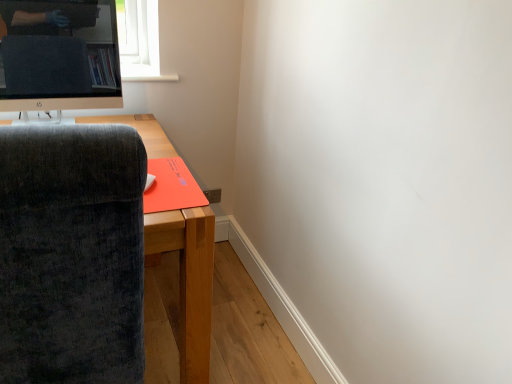
This screenshot has height=384, width=512. What are the coordinates of `orange matte mousepad at lower left` in the screenshot? It's located at (170, 187).

I want to click on dark gray fabric chair at left, so (x=188, y=284).

What do you see at coordinates (59, 55) in the screenshot? I see `satin black monitor at upper left` at bounding box center [59, 55].

The image size is (512, 384). What are the coordinates of `satin black monitor at upper left` in the screenshot? It's located at (59, 55).

Identify the location of orange matte mousepad at lower left. (170, 187).

How different are the orientations of velvet dark gray chair at left and satin black monitor at upper left in degrees?

The facing directions of velvet dark gray chair at left and satin black monitor at upper left are 178 degrees apart.

Which of these two, velvet dark gray chair at left or satin black monitor at upper left, stands taller?

With more height is velvet dark gray chair at left.

Is velvet dark gray chair at left closer to the viewer compared to satin black monitor at upper left?

Yes, it is.

Are velvet dark gray chair at left and satin black monitor at upper left far apart?

Indeed, velvet dark gray chair at left is not near satin black monitor at upper left.

Considering the sizes of satin black monitor at upper left and velvet dark gray chair at left in the image, is satin black monitor at upper left taller or shorter than velvet dark gray chair at left?

satin black monitor at upper left is shorter than velvet dark gray chair at left.

Is satin black monitor at upper left not close to velvet dark gray chair at left?

satin black monitor at upper left is far away from velvet dark gray chair at left.

Based on the photo, looking at the image, does satin black monitor at upper left seem bigger or smaller compared to velvet dark gray chair at left?

In the image, satin black monitor at upper left appears to be smaller than velvet dark gray chair at left.

From a real-world perspective, between satin black monitor at upper left and velvet dark gray chair at left, who is vertically lower?

In real-world perspective, velvet dark gray chair at left is lower.

Would you say satin black monitor at upper left is a long distance from dark gray fabric chair at left?

No.

Where is `entertainment center lying in front of the satin black monitor at upper left`? This screenshot has height=384, width=512. entertainment center lying in front of the satin black monitor at upper left is located at coordinates (188, 284).

Can you confirm if satin black monitor at upper left is taller than orange matte mousepad at lower left?

Indeed, satin black monitor at upper left has a greater height compared to orange matte mousepad at lower left.

Looking at their sizes, would you say satin black monitor at upper left is wider or thinner than orange matte mousepad at lower left?

satin black monitor at upper left is thinner than orange matte mousepad at lower left.

Which object is further away from the camera taking this photo, satin black monitor at upper left or orange matte mousepad at lower left?

satin black monitor at upper left is more distant.

Where is `television located behind the orange matte mousepad at lower left`? The height and width of the screenshot is (384, 512). television located behind the orange matte mousepad at lower left is located at coordinates (x=59, y=55).

Can you see dark gray fabric chair at left touching velvet dark gray chair at left?

No, dark gray fabric chair at left is not making contact with velvet dark gray chair at left.

Considering the relative positions of dark gray fabric chair at left and velvet dark gray chair at left in the image provided, is dark gray fabric chair at left behind velvet dark gray chair at left?

Yes, the depth of dark gray fabric chair at left is greater than that of velvet dark gray chair at left.

At what (x,y) coordinates should I click in order to perform the action: click on entertainment center that appears above the velvet dark gray chair at left (from the image's perspective). Please return your answer as a coordinate pair (x, y). This screenshot has width=512, height=384. Looking at the image, I should click on (188, 284).

Consider the image. From the image's perspective, between dark gray fabric chair at left and velvet dark gray chair at left, who is located below?

velvet dark gray chair at left.

Is orange matte mousepad at lower left oriented away from velvet dark gray chair at left?

No.

Between orange matte mousepad at lower left and velvet dark gray chair at left, which one has smaller size?

Smaller between the two is orange matte mousepad at lower left.

Is orange matte mousepad at lower left at the right side of velvet dark gray chair at left?

Indeed, orange matte mousepad at lower left is positioned on the right side of velvet dark gray chair at left.

In the image, there is a velvet dark gray chair at left. Where is `book above it (from the image's perspective)`? Image resolution: width=512 pixels, height=384 pixels. book above it (from the image's perspective) is located at coordinates (170, 187).

Considering the relative sizes of velvet dark gray chair at left and orange matte mousepad at lower left in the image provided, is velvet dark gray chair at left bigger than orange matte mousepad at lower left?

Yes, velvet dark gray chair at left is bigger than orange matte mousepad at lower left.

How different are the orientations of velvet dark gray chair at left and orange matte mousepad at lower left in degrees?

The facing directions of velvet dark gray chair at left and orange matte mousepad at lower left are 178 degrees apart.

Can you confirm if velvet dark gray chair at left is thinner than orange matte mousepad at lower left?

No, velvet dark gray chair at left is not thinner than orange matte mousepad at lower left.

At what (x,y) coordinates should I click in order to perform the action: click on chair in front of the satin black monitor at upper left. Please return your answer as a coordinate pair (x, y). The image size is (512, 384). Looking at the image, I should click on (72, 255).

This screenshot has height=384, width=512. Identify the location of television lying above the velvet dark gray chair at left (from the image's perspective). (59, 55).

From the image, which object appears to be farther from satin black monitor at upper left, orange matte mousepad at lower left or dark gray fabric chair at left?

orange matte mousepad at lower left is positioned further to the anchor satin black monitor at upper left.

When comparing their distances from velvet dark gray chair at left, does satin black monitor at upper left or dark gray fabric chair at left seem further?

satin black monitor at upper left lies further to velvet dark gray chair at left than the other object.

When comparing their distances from velvet dark gray chair at left, does satin black monitor at upper left or orange matte mousepad at lower left seem closer?

orange matte mousepad at lower left lies closer to velvet dark gray chair at left than the other object.

From the picture: Looking at the image, which one is located further to dark gray fabric chair at left, satin black monitor at upper left or orange matte mousepad at lower left?

orange matte mousepad at lower left.

From the image, which object appears to be nearer to velvet dark gray chair at left, orange matte mousepad at lower left or satin black monitor at upper left?

orange matte mousepad at lower left lies closer to velvet dark gray chair at left than the other object.

Looking at the image, which one is located further to satin black monitor at upper left, dark gray fabric chair at left or orange matte mousepad at lower left?

The object further to satin black monitor at upper left is orange matte mousepad at lower left.

Estimate the real-world distances between objects in this image. Which object is further from velvet dark gray chair at left, dark gray fabric chair at left or satin black monitor at upper left?

The object further to velvet dark gray chair at left is satin black monitor at upper left.

Estimate the real-world distances between objects in this image. Which object is further from satin black monitor at upper left, orange matte mousepad at lower left or velvet dark gray chair at left?

velvet dark gray chair at left is positioned further to the anchor satin black monitor at upper left.

You are a GUI agent. You are given a task and a screenshot of the screen. Output one action in this format:
    pyautogui.click(x=<x>, y=<y>)
    Task: Click on the entertainment center positioned between velvet dark gray chair at left and satin black monitor at upper left from near to far
    
    Given the screenshot: What is the action you would take?
    pyautogui.click(x=188, y=284)

You are a GUI agent. You are given a task and a screenshot of the screen. Output one action in this format:
    pyautogui.click(x=<x>, y=<y>)
    Task: Click on the book between satin black monitor at upper left and dark gray fabric chair at left in the up-down direction
    This screenshot has width=512, height=384.
    Given the screenshot: What is the action you would take?
    pyautogui.click(x=170, y=187)

At what (x,y) coordinates should I click in order to perform the action: click on book between velvet dark gray chair at left and satin black monitor at upper left in the front-back direction. Please return your answer as a coordinate pair (x, y). Looking at the image, I should click on (170, 187).

Identify the location of entertainment center between velvet dark gray chair at left and orange matte mousepad at lower left from front to back. (188, 284).